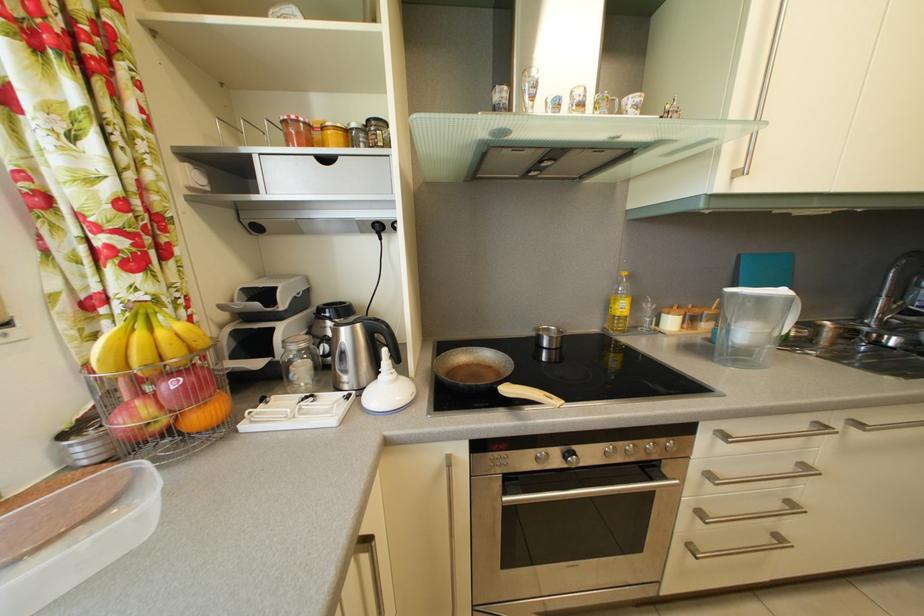
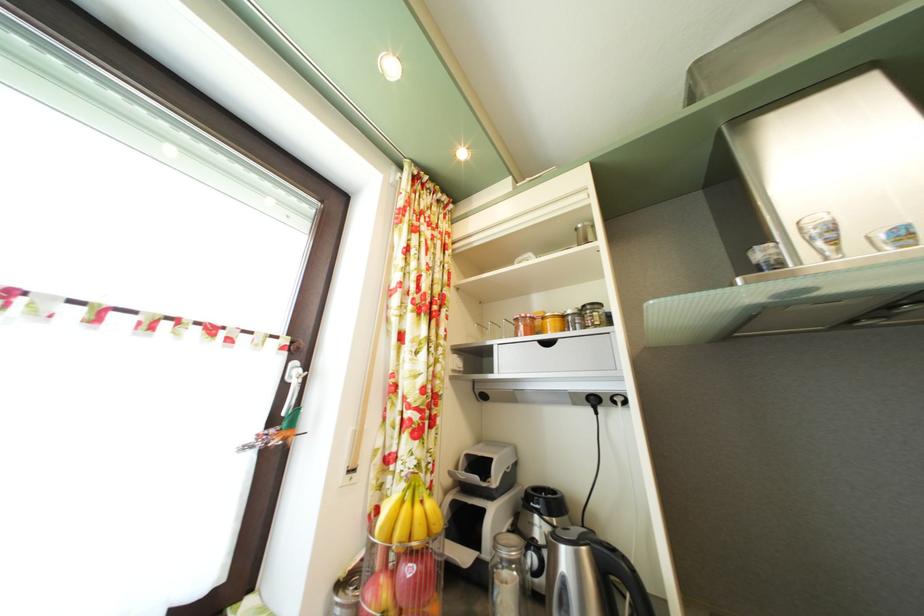
The point at (168,339) is marked in the first image. Where is the corresponding point in the second image?

(426, 516)